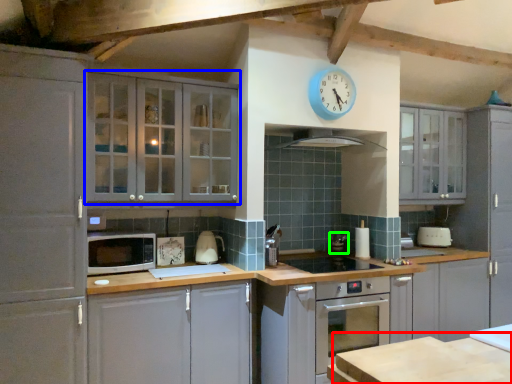
Question: Which is farther away from table (highlighted by a red box)? cabinetry (highlighted by a blue box) or appliance (highlighted by a green box)?

Choices:
 (A) cabinetry
 (B) appliance

Answer: (B)